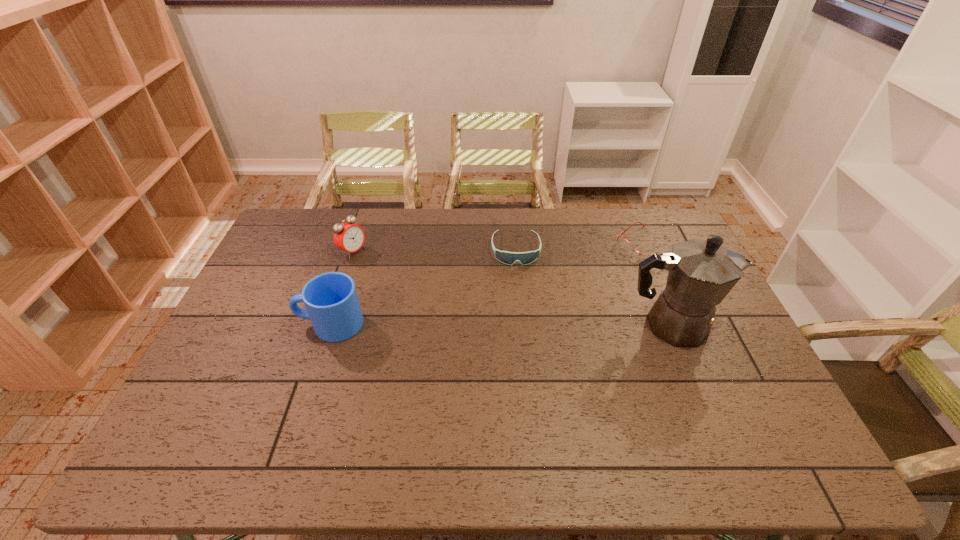
This screenshot has height=540, width=960. Identify the location of mug. (332, 305).

Identify the location of coffeepot. (701, 273).

Locate an element on the screen. The image size is (960, 540). the third object from left to right is located at coordinates (509, 258).

The image size is (960, 540). I want to click on the second shortest object, so click(x=509, y=258).

Image resolution: width=960 pixels, height=540 pixels. Find the location of `the shortest object`. the shortest object is located at coordinates (624, 244).

Where is `alarm clock`? Image resolution: width=960 pixels, height=540 pixels. alarm clock is located at coordinates (349, 237).

I want to click on blank space located 0.090m on the side of the mug with the handle, so click(x=267, y=324).

You are a GUI agent. You are given a task and a screenshot of the screen. Output one action in this format:
    pyautogui.click(x=<x>, y=<y>)
    Task: Click on the free region located 0.130m on the side of the mug with the handle
    
    Given the screenshot: What is the action you would take?
    [253, 324]

You are a GUI agent. You are given a task and a screenshot of the screen. Output one action in this format:
    pyautogui.click(x=<x>, y=<y>)
    Task: Click on the vacant space situated 0.160m on the side of the mug with the handle
    Image resolution: width=960 pixels, height=540 pixels.
    Given the screenshot: What is the action you would take?
    [244, 324]

The height and width of the screenshot is (540, 960). Find the location of `vacant space located 0.080m on the front-facing side of the second shortest object`. vacant space located 0.080m on the front-facing side of the second shortest object is located at coordinates (518, 284).